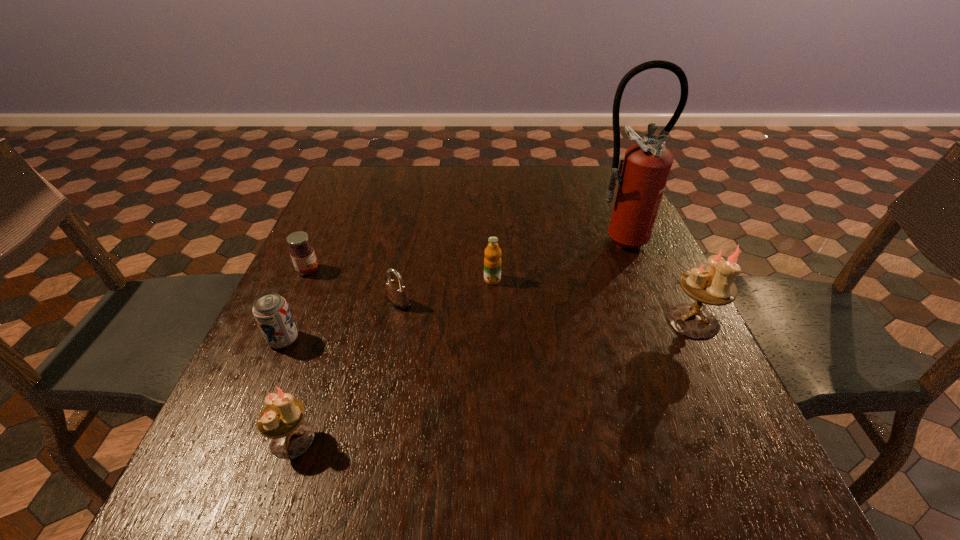
Find the location of a particular element. The image size is (960, 540). the fifth closest object to the jam is located at coordinates (643, 172).

Identify which object is located as the nearest to the fifth object from left to right. Please provide its 2D coordinates. Your answer should be formatted as a tuple, i.e. [(x, y)], where the tuple contains the x and y coordinates of a point satisfying the conditions above.

[(397, 296)]

Find the location of a particular element. The height and width of the screenshot is (540, 960). free space that satisfies the following two spatial constraints: 1. on the front side of the beer can; 2. on the right side of the fifth shortest object is located at coordinates (240, 440).

This screenshot has width=960, height=540. Identify the location of vacant space that satisfies the following two spatial constraints: 1. on the label side of the sixth shortest object; 2. on the right side of the jam. (285, 321).

I want to click on free location that satisfies the following two spatial constraints: 1. on the label side of the nearest object; 2. on the left side of the jam, so click(x=231, y=440).

Identify the location of vacant space that satisfies the following two spatial constraints: 1. on the label side of the jam; 2. on the left side of the fourth object from right to left. (293, 303).

The image size is (960, 540). I want to click on vacant space that satisfies the following two spatial constraints: 1. on the back side of the farther candle holder; 2. on the label side of the jam, so click(667, 271).

Locate an element on the screen. free spot that satisfies the following two spatial constraints: 1. at the nozzle of the farthest object; 2. on the label side of the jam is located at coordinates (628, 271).

Where is `blank area in the image that satisfies the following two spatial constraints: 1. on the label of the sixth shortest object; 2. on the left side of the orange juice`? This screenshot has height=540, width=960. blank area in the image that satisfies the following two spatial constraints: 1. on the label of the sixth shortest object; 2. on the left side of the orange juice is located at coordinates (493, 321).